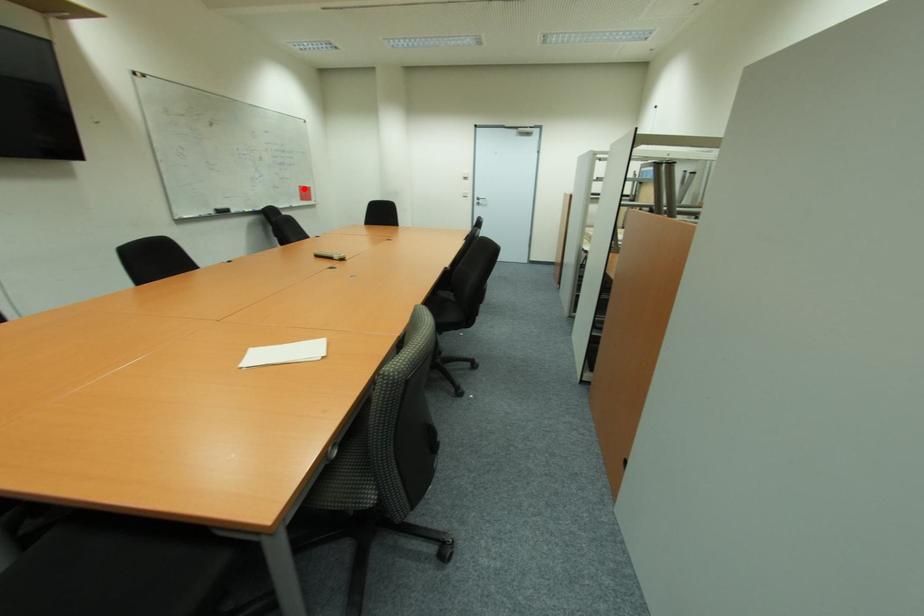
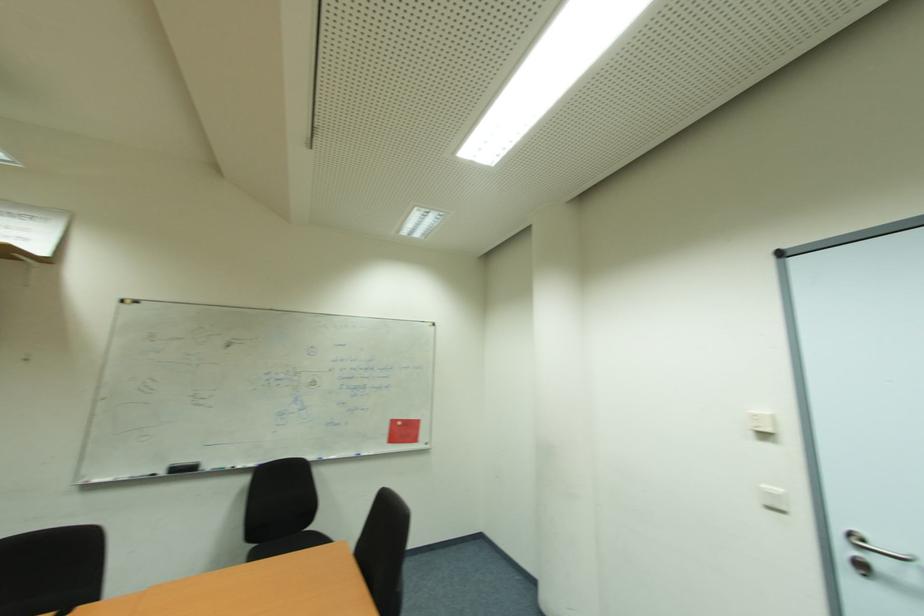
Where in the second image is the point corresponding to the highlighted location from the first image?

(397, 423)